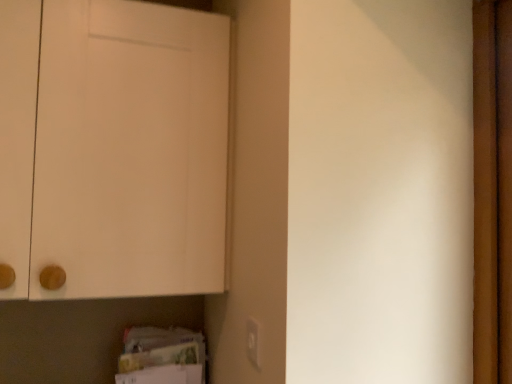
Question: Is white matte cabinet at upper left positioned beyond the bounds of matte white electric outlet at lower center?

Choices:
 (A) no
 (B) yes

Answer: (B)

Question: Is white matte cabinet at upper left facing away from matte white electric outlet at lower center?

Choices:
 (A) yes
 (B) no

Answer: (B)

Question: Is the position of white matte cabinet at upper left more distant than that of matte white electric outlet at lower center?

Choices:
 (A) no
 (B) yes

Answer: (B)

Question: Can you confirm if white matte cabinet at upper left is positioned to the left of matte white electric outlet at lower center?

Choices:
 (A) no
 (B) yes

Answer: (B)

Question: Can you confirm if white matte cabinet at upper left is wider than matte white electric outlet at lower center?

Choices:
 (A) yes
 (B) no

Answer: (A)

Question: Can you confirm if white matte cabinet at upper left is smaller than matte white electric outlet at lower center?

Choices:
 (A) yes
 (B) no

Answer: (B)

Question: Is matte white electric outlet at lower center thinner than white matte cabinet at upper left?

Choices:
 (A) no
 (B) yes

Answer: (B)

Question: Does matte white electric outlet at lower center contain white matte cabinet at upper left?

Choices:
 (A) no
 (B) yes

Answer: (A)

Question: Is matte white electric outlet at lower center facing away from white matte cabinet at upper left?

Choices:
 (A) no
 (B) yes

Answer: (A)

Question: From the image's perspective, is matte white electric outlet at lower center on white matte cabinet at upper left?

Choices:
 (A) no
 (B) yes

Answer: (A)

Question: From a real-world perspective, is matte white electric outlet at lower center on white matte cabinet at upper left?

Choices:
 (A) no
 (B) yes

Answer: (A)

Question: Considering the relative sizes of matte white electric outlet at lower center and white matte cabinet at upper left in the image provided, is matte white electric outlet at lower center bigger than white matte cabinet at upper left?

Choices:
 (A) no
 (B) yes

Answer: (A)

Question: From the image's perspective, is white matte cabinet at upper left above or below matte white electric outlet at lower center?

Choices:
 (A) below
 (B) above

Answer: (B)